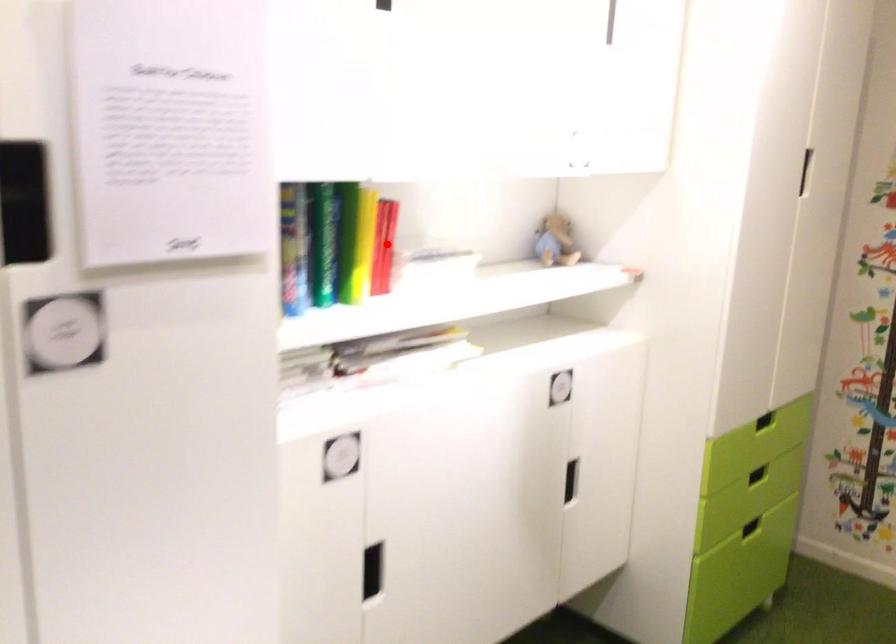
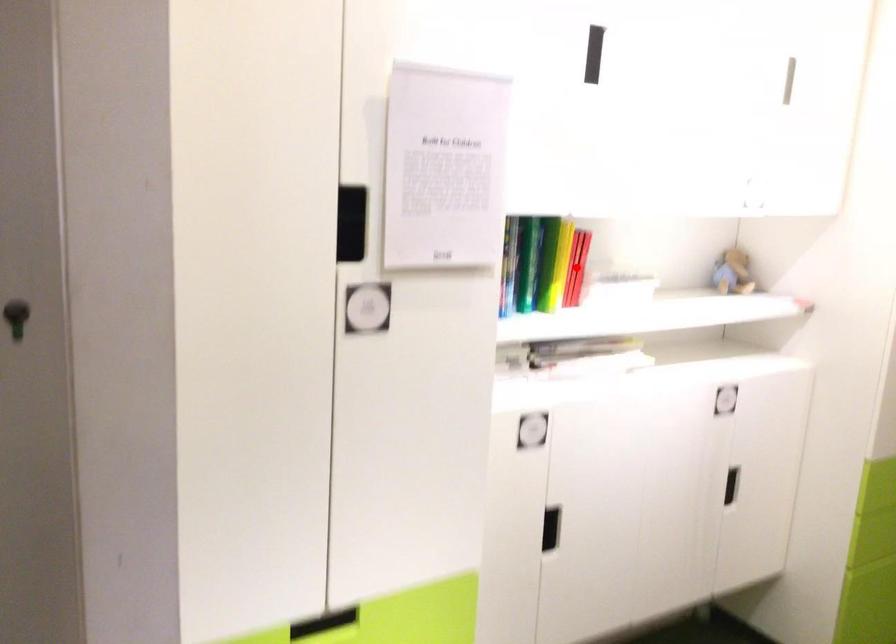
I am providing you with two images of the same scene from different viewpoints. A red point is marked on the first image and another point is marked on the second image. Is the marked point in image1 the same physical position as the marked point in image2?

Yes